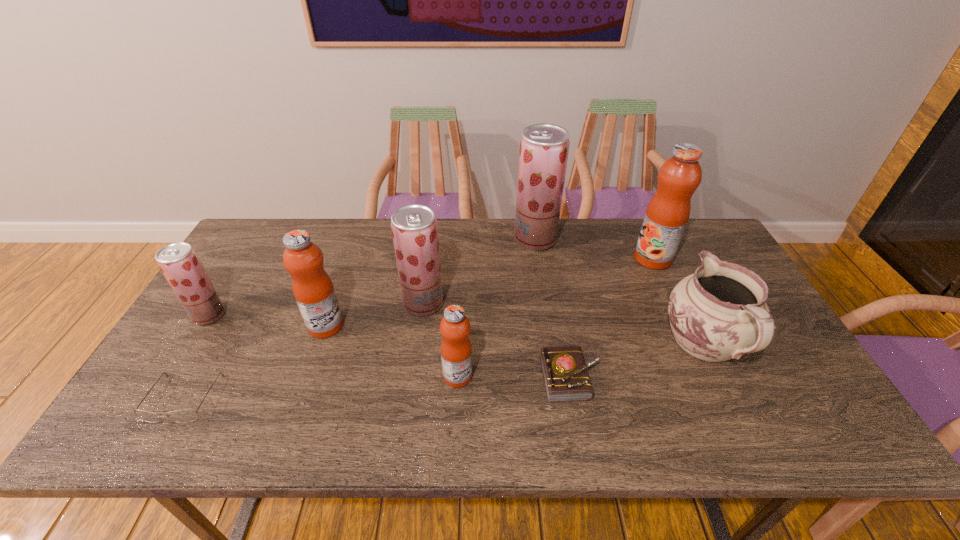
You are a GUI agent. You are given a task and a screenshot of the screen. Output one action in this format:
    pyautogui.click(x=<x>, y=<y>)
    Task: Click on the fifth object from right to left
    This screenshot has height=540, width=960.
    Given the screenshot: What is the action you would take?
    pyautogui.click(x=456, y=350)

Where is `the nearest fruit juice`? Image resolution: width=960 pixels, height=540 pixels. the nearest fruit juice is located at coordinates (456, 350).

Identify the location of purple pitcher. (718, 313).

Image resolution: width=960 pixels, height=540 pixels. Identify the location of diary. point(566,378).

Find the location of a particular element. The width and height of the screenshot is (960, 540). spectacles is located at coordinates (181, 416).

Where is `vacant region located on the left of the rightmost strawberry fruit juice`? vacant region located on the left of the rightmost strawberry fruit juice is located at coordinates (469, 240).

I want to click on vacant region located on the front label of the rightmost orange fruit juice, so click(x=615, y=259).

At what (x,y) coordinates should I click in order to perform the action: click on free space located 0.240m on the front label of the rightmost orange fruit juice. Please return your answer as a coordinate pair (x, y). This screenshot has width=960, height=540. Looking at the image, I should click on (559, 259).

This screenshot has width=960, height=540. I want to click on vacant region located on the front label of the rightmost orange fruit juice, so [x=574, y=259].

This screenshot has width=960, height=540. Identify the location of free space located 0.360m on the left of the third fruit juice from left to right. (277, 303).